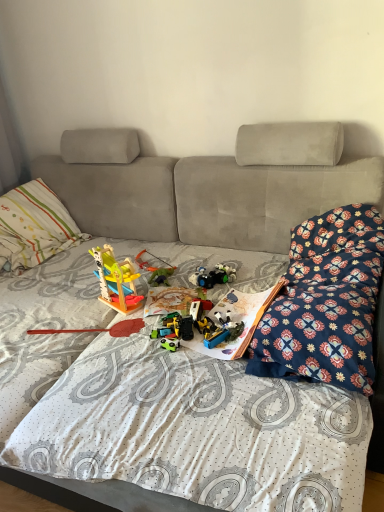
Image resolution: width=384 pixels, height=512 pixels. I want to click on vacant space situated above wooden toy at center (from a real-world perspective), so click(86, 323).